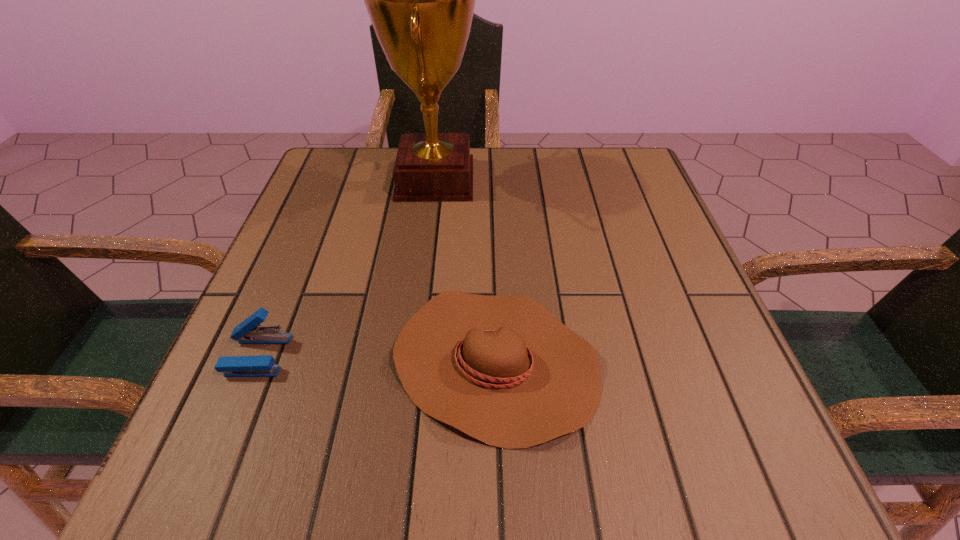
Where is `award`? The width and height of the screenshot is (960, 540). award is located at coordinates (421, 0).

Find the location of a particular element. the farthest object is located at coordinates (421, 0).

Image resolution: width=960 pixels, height=540 pixels. Identify the location of the leftmost object. (247, 332).

Where is `the second tallest object`? The height and width of the screenshot is (540, 960). the second tallest object is located at coordinates (247, 332).

You are a GUI agent. You are given a task and a screenshot of the screen. Output one action in this format:
    pyautogui.click(x=<x>, y=<y>)
    Task: Click on the cowboy hat
    
    Given the screenshot: What is the action you would take?
    pyautogui.click(x=502, y=369)

Identify the location of vacant area situated 0.130m on the plaque of the tallest object. point(532,179).

Identify the location of blank area located 0.400m on the back of the leftmost object. This screenshot has width=960, height=540. (324, 193).

I want to click on vacant space situated on the right of the shortest object, so point(654,362).

Where is `object that is at the far edge`? The image size is (960, 540). object that is at the far edge is located at coordinates 421,0.

Identify the location of object at the near edge. The width and height of the screenshot is (960, 540). (502, 369).